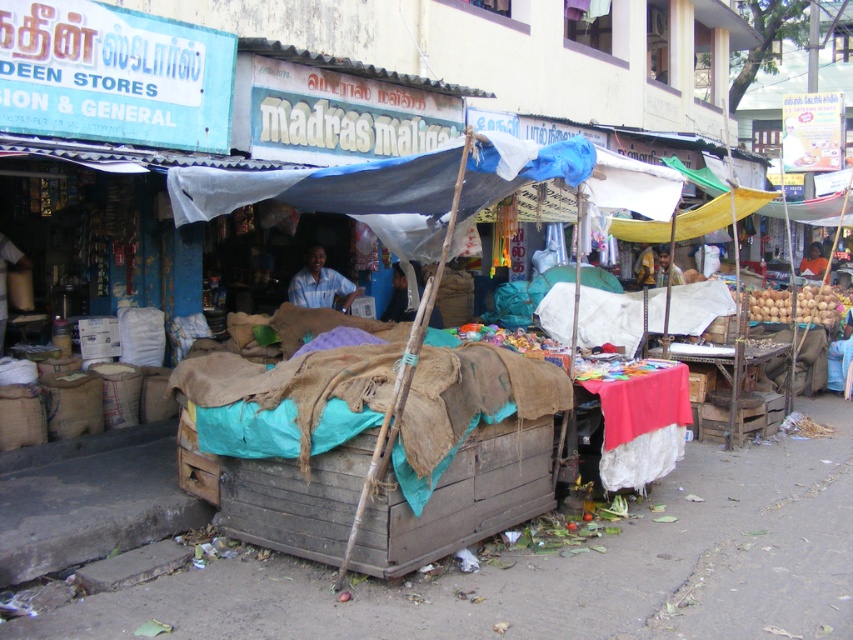
Is brown wooden crate at lower center thinner than blue fabric at center?

Incorrect, brown wooden crate at lower center's width is not less than blue fabric at center's.

In order to click on brown wooden crate at lower center in this screenshot , I will do `click(560, 566)`.